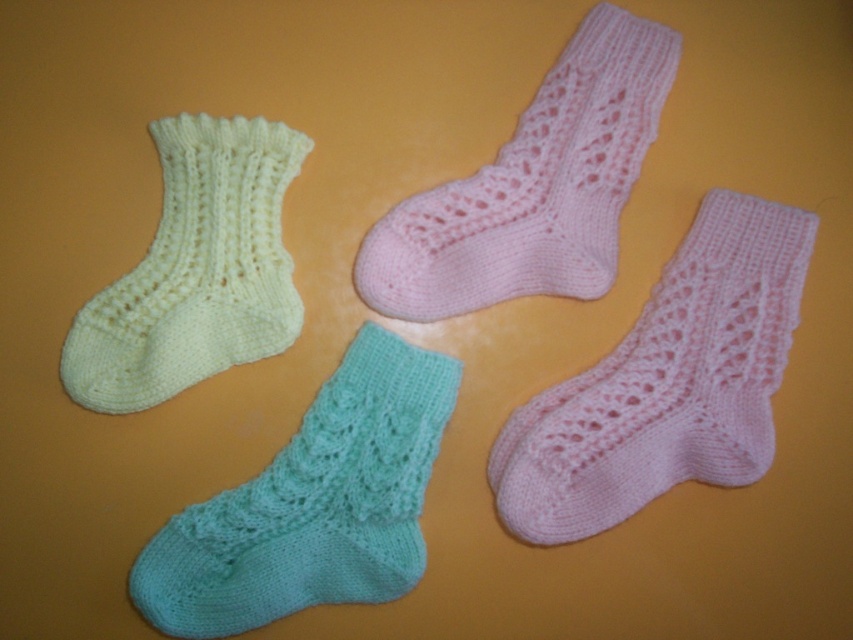
Based on the photo, can you confirm if mint green knitted sock at lower left is positioned to the left of light yellow knitted sock at left?

Incorrect, mint green knitted sock at lower left is not on the left side of light yellow knitted sock at left.

Does point (389, 362) come closer to viewer compared to point (152, 339)?

No.

You are a GUI agent. You are given a task and a screenshot of the screen. Output one action in this format:
    pyautogui.click(x=<x>, y=<y>)
    Task: Click on the mint green knitted sock at lower left
    The height and width of the screenshot is (640, 853).
    Given the screenshot: What is the action you would take?
    pyautogui.click(x=312, y=504)

Is pink knitted sock at upper center wider than light yellow knitted sock at left?

Indeed, pink knitted sock at upper center has a greater width compared to light yellow knitted sock at left.

Who is lower down, pink knitted sock at upper center or light yellow knitted sock at left?

light yellow knitted sock at left

Is point (561, 262) closer to camera compared to point (267, 250)?

No, (561, 262) is further to viewer.

Identify the location of pink knitted sock at upper center. Image resolution: width=853 pixels, height=640 pixels. (532, 186).

Is point (651, 442) positioned before point (508, 294)?

Yes, point (651, 442) is closer to viewer.

Does pink knitted sock at center have a larger size compared to pink knitted sock at upper center?

Indeed, pink knitted sock at center has a larger size compared to pink knitted sock at upper center.

Between point (738, 417) and point (610, 100), which one is positioned behind?

The point (610, 100) is more distant.

This screenshot has height=640, width=853. Identify the location of pink knitted sock at center. (666, 381).